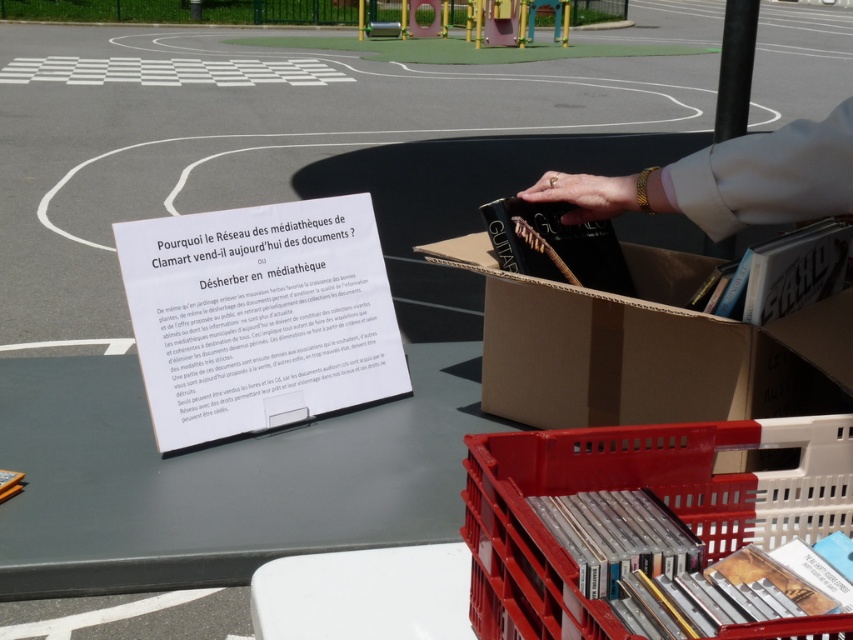
Is brown cardboard box at center below red plastic crate at lower right?

Actually, brown cardboard box at center is above red plastic crate at lower right.

Which is in front, point (640, 420) or point (762, 506)?

Point (762, 506) is more forward.

Which is behind, point (592, 321) or point (595, 621)?

The point (592, 321) is more distant.

Locate an element on the screen. Image resolution: width=853 pixels, height=640 pixels. brown cardboard box at center is located at coordinates (646, 348).

Which of these two, brown cardboard box at center or gold bracelet at upper right, stands taller?

brown cardboard box at center is taller.

At what (x,y) coordinates should I click in order to perform the action: click on brown cardboard box at center. Please return your answer as a coordinate pair (x, y). Image resolution: width=853 pixels, height=640 pixels. Looking at the image, I should click on (646, 348).

This screenshot has height=640, width=853. Describe the element at coordinates (646, 348) in the screenshot. I see `brown cardboard box at center` at that location.

Where is `brown cardboard box at center`? brown cardboard box at center is located at coordinates (646, 348).

Is red plastic crate at lower right above gold bracelet at upper right?

Actually, red plastic crate at lower right is below gold bracelet at upper right.

Between red plastic crate at lower right and gold bracelet at upper right, which one has more height?

Standing taller between the two is red plastic crate at lower right.

Who is more distant from viewer, (560, 618) or (750, 186)?

Point (750, 186)

Identify the location of red plastic crate at lower right. The width and height of the screenshot is (853, 640). (630, 490).